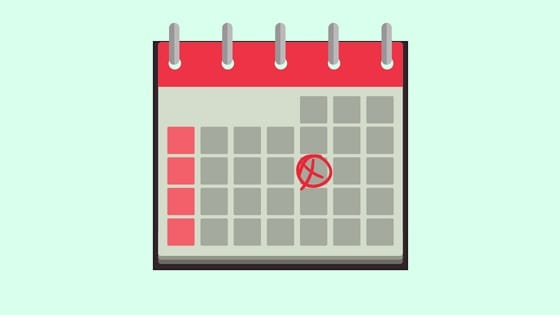
The width and height of the screenshot is (560, 315). In order to click on red squares on calendar in this screenshot , I will do `click(179, 232)`, `click(181, 205)`, `click(188, 174)`, `click(174, 147)`.